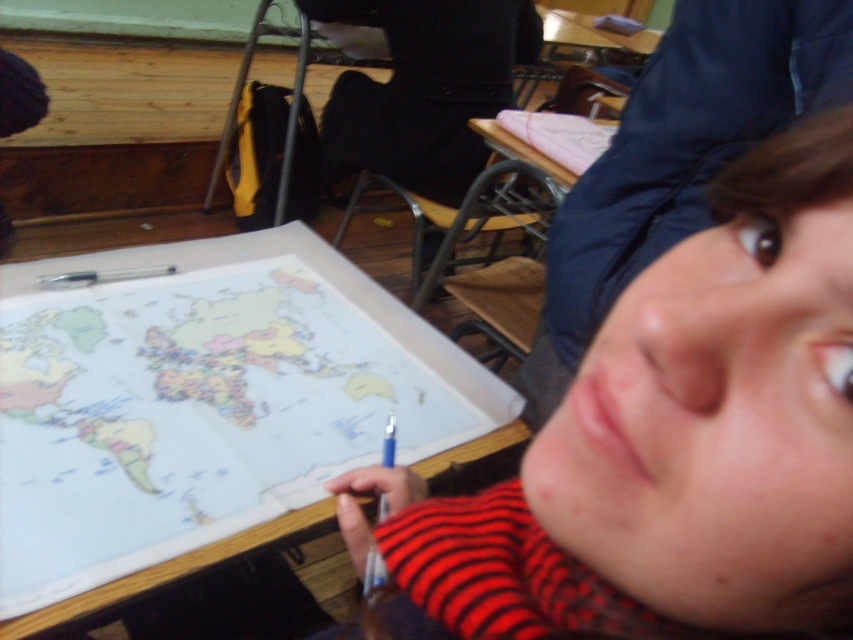
Is striped sweater at center further to camera compared to smooth skin face at upper right?

No, striped sweater at center is closer to the viewer.

Between point (555, 620) and point (676, 189), which one is positioned behind?

Point (676, 189)

Image resolution: width=853 pixels, height=640 pixels. What are the coordinates of `striped sweater at center` in the screenshot? It's located at (669, 444).

Does point (758, 58) come farther from viewer compared to point (503, 401)?

No, (758, 58) is closer to viewer.

Looking at this image, does smooth skin face at upper right come in front of wooden table at center?

Yes, it is in front of wooden table at center.

Where is `smooth skin face at upper right`? This screenshot has height=640, width=853. smooth skin face at upper right is located at coordinates (677, 156).

Where is `smooth skin face at upper right`? The image size is (853, 640). smooth skin face at upper right is located at coordinates (677, 156).

Between striped sweater at center and wooden table at center, which one is positioned higher?

wooden table at center is above.

Who is positioned more to the left, striped sweater at center or wooden table at center?

wooden table at center is more to the left.

Is point (802, 536) closer to viewer compared to point (502, 392)?

Yes, point (802, 536) is closer to viewer.

Locate an element on the screen. striped sweater at center is located at coordinates (669, 444).